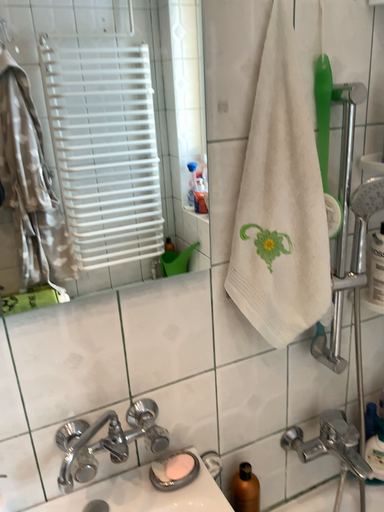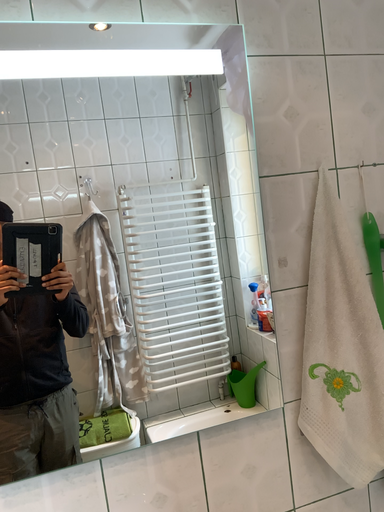
Question: How did the camera likely rotate when shooting the video?

Choices:
 (A) rotated upward
 (B) rotated downward

Answer: (A)